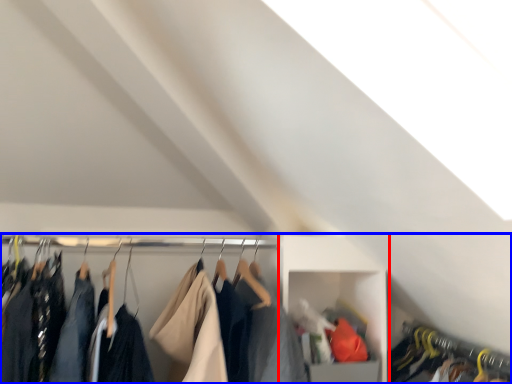
Question: Which of the following is the closest to the observer, cabinet (highlighted by a red box) or closet (highlighted by a blue box)?

Choices:
 (A) cabinet
 (B) closet

Answer: (B)